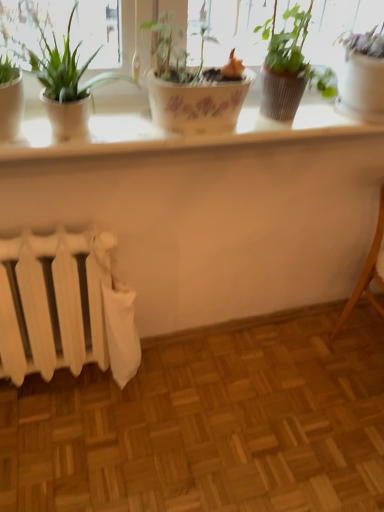
Question: Is point (362, 115) closer or farther from the camera than point (18, 117)?

Choices:
 (A) farther
 (B) closer

Answer: (A)

Question: Visually, is white glossy pot at upper right, the fourth houseplant when ordered from left to right, positioned to the left or to the right of green glossy plant at left, the 4th houseplant from the right?

Choices:
 (A) right
 (B) left

Answer: (A)

Question: Considering the real-world distances, which object is farthest from the white glossy counter top at upper center?

Choices:
 (A) green matte pot at upper center, which is counted as the second houseplant, starting from the right
 (B) white glossy pot at upper right, marked as the first houseplant in a right-to-left arrangement
 (C) white matte radiator at lower left
 (D) light brown wooden chair at lower right
 (E) green matte plant at left, the 2th houseplant from the left

Answer: (D)

Question: Based on their relative distances, which object is nearer to the white matte radiator at lower left?

Choices:
 (A) green matte pot at upper center, which is counted as the second houseplant, starting from the right
 (B) green glossy plant at left, marked as the first houseplant in a left-to-right arrangement
 (C) green matte plant at left, the 2th houseplant from the left
 (D) white glossy pot at upper right, the fourth houseplant when ordered from left to right
 (E) white glossy counter top at upper center

Answer: (E)